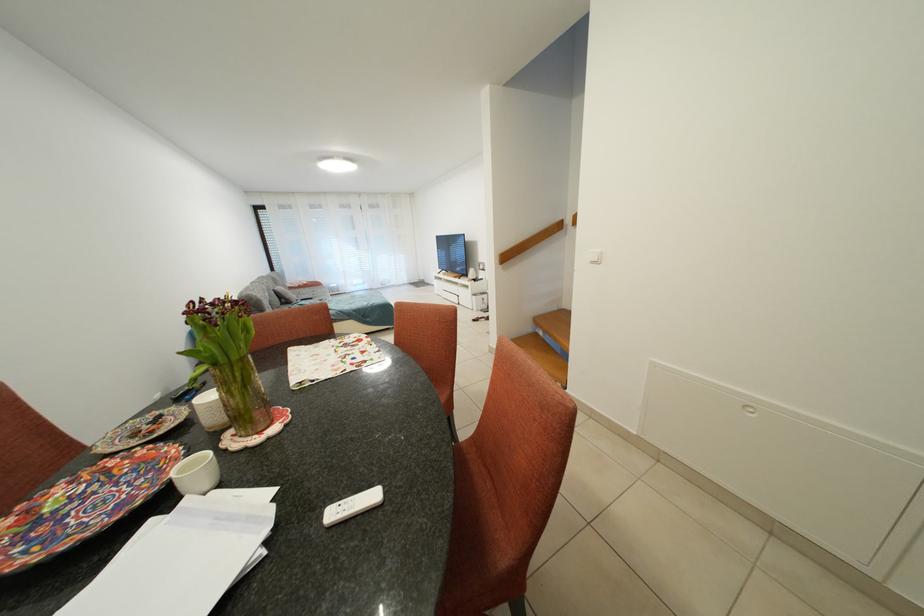
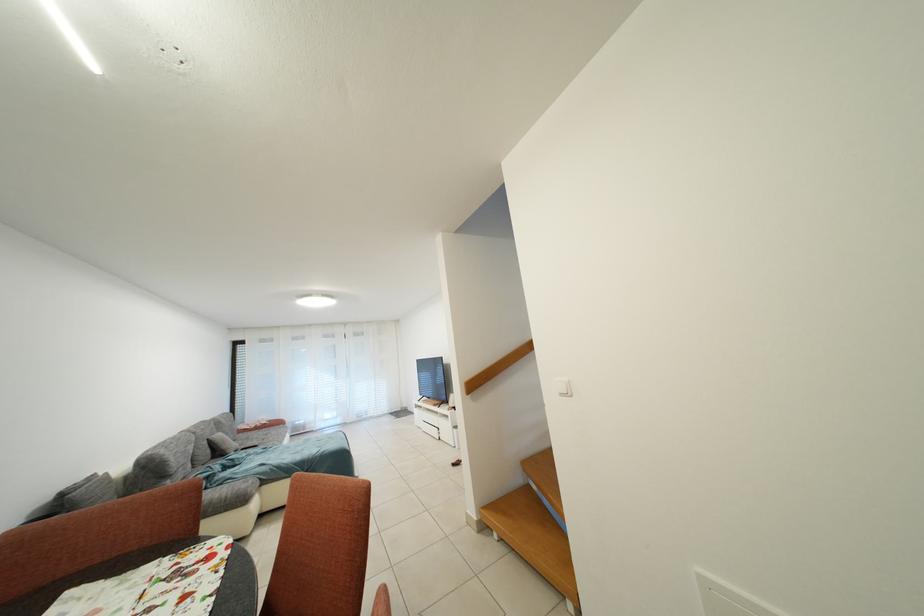
Where in the second image is the point corresponding to point 288,294 from the first image?

(227, 440)